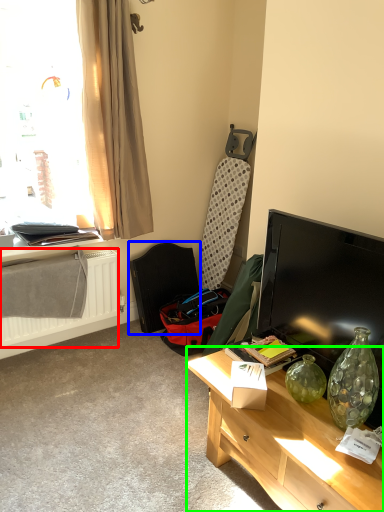
Question: Which is nearer to the radiator (highlighted by a red box)? swivel chair (highlighted by a blue box) or desk (highlighted by a green box).

Choices:
 (A) swivel chair
 (B) desk

Answer: (A)